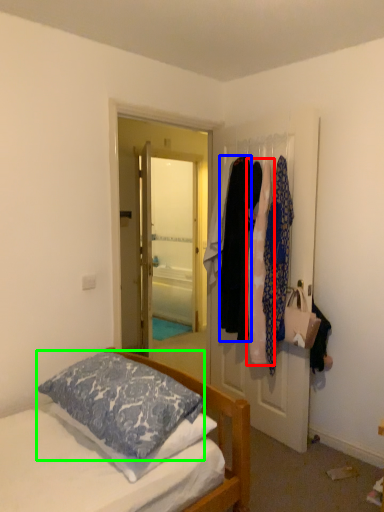
Question: Estimate the real-world distances between objects in this image. Which object is farther from clothing (highlighted by a red box), clothing (highlighted by a blue box) or pillow (highlighted by a green box)?

Choices:
 (A) clothing
 (B) pillow

Answer: (B)